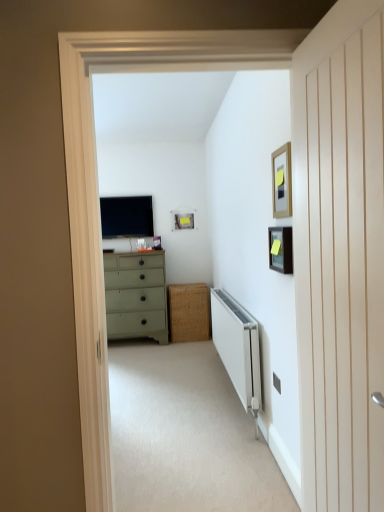
Question: Is wooden picture frame at upper right, positioned as the 1th picture frame in front-to-back order, looking in the opposite direction of beige carpet at center?

Choices:
 (A) no
 (B) yes

Answer: (A)

Question: Does wooden picture frame at upper right, the third picture frame viewed from the back, touch beige carpet at center?

Choices:
 (A) yes
 (B) no

Answer: (B)

Question: Is wooden picture frame at upper right, positioned as the 1th picture frame in front-to-back order, positioned before beige carpet at center?

Choices:
 (A) no
 (B) yes

Answer: (A)

Question: From a real-world perspective, is wooden picture frame at upper right, which appears as the 3th picture frame when viewed from the left, physically below beige carpet at center?

Choices:
 (A) yes
 (B) no

Answer: (B)

Question: Considering the relative sizes of wooden picture frame at upper right, positioned as the 1th picture frame in front-to-back order, and beige carpet at center in the image provided, is wooden picture frame at upper right, positioned as the 1th picture frame in front-to-back order, shorter than beige carpet at center?

Choices:
 (A) yes
 (B) no

Answer: (B)

Question: Considering the positions of point (251, 331) and point (130, 426), is point (251, 331) closer or farther from the camera than point (130, 426)?

Choices:
 (A) farther
 (B) closer

Answer: (B)

Question: Considering the positions of white metallic radiator at lower center and beige carpet at center in the image, is white metallic radiator at lower center wider or thinner than beige carpet at center?

Choices:
 (A) wide
 (B) thin

Answer: (B)

Question: In terms of height, does white metallic radiator at lower center look taller or shorter compared to beige carpet at center?

Choices:
 (A) short
 (B) tall

Answer: (B)

Question: Visually, is white metallic radiator at lower center positioned to the left or to the right of beige carpet at center?

Choices:
 (A) right
 (B) left

Answer: (A)

Question: In the image, is matte black tv at center positioned in front of or behind matte black picture frame at upper right, positioned as the second picture frame in left-to-right order?

Choices:
 (A) front
 (B) behind

Answer: (B)

Question: Is matte black tv at center inside the boundaries of matte black picture frame at upper right, the 2th picture frame in the back-to-front sequence, or outside?

Choices:
 (A) inside
 (B) outside

Answer: (B)

Question: Considering the positions of point (147, 225) and point (286, 245), is point (147, 225) closer or farther from the camera than point (286, 245)?

Choices:
 (A) farther
 (B) closer

Answer: (A)

Question: Is matte black tv at center taller or shorter than matte black picture frame at upper right, the 2th picture frame viewed from the front?

Choices:
 (A) tall
 (B) short

Answer: (A)

Question: Based on their sizes in the image, would you say beige carpet at center is bigger or smaller than white wood door at right?

Choices:
 (A) small
 (B) big

Answer: (B)

Question: From a real-world perspective, is beige carpet at center physically located above or below white wood door at right?

Choices:
 (A) below
 (B) above

Answer: (A)